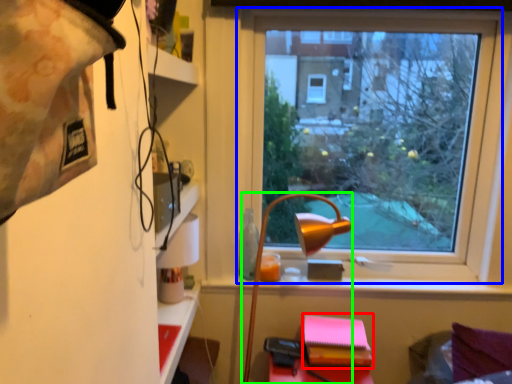
Question: Considering the real-world distances, which object is closest to notebook (highlighted by a red box)? window (highlighted by a blue box) or lamp (highlighted by a green box).

Choices:
 (A) window
 (B) lamp

Answer: (B)